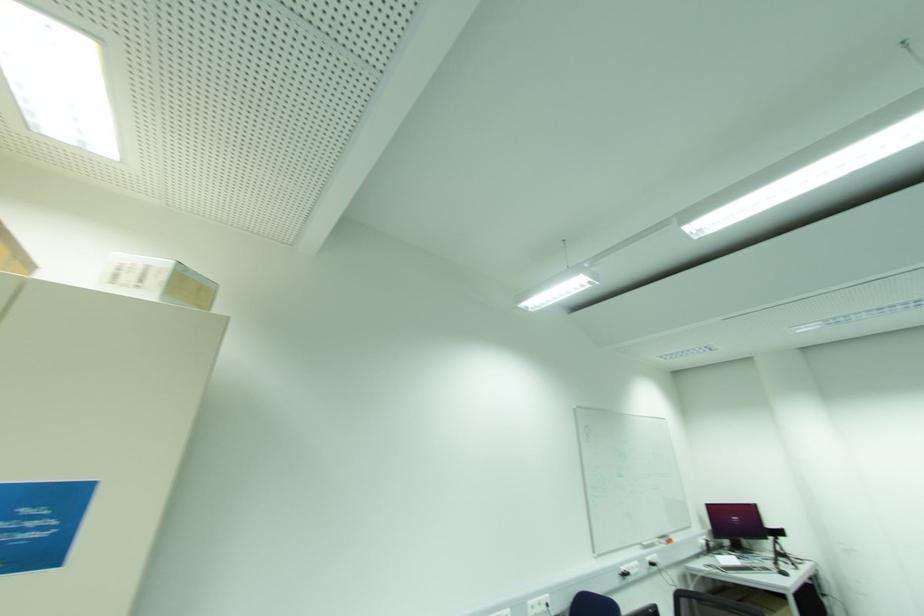
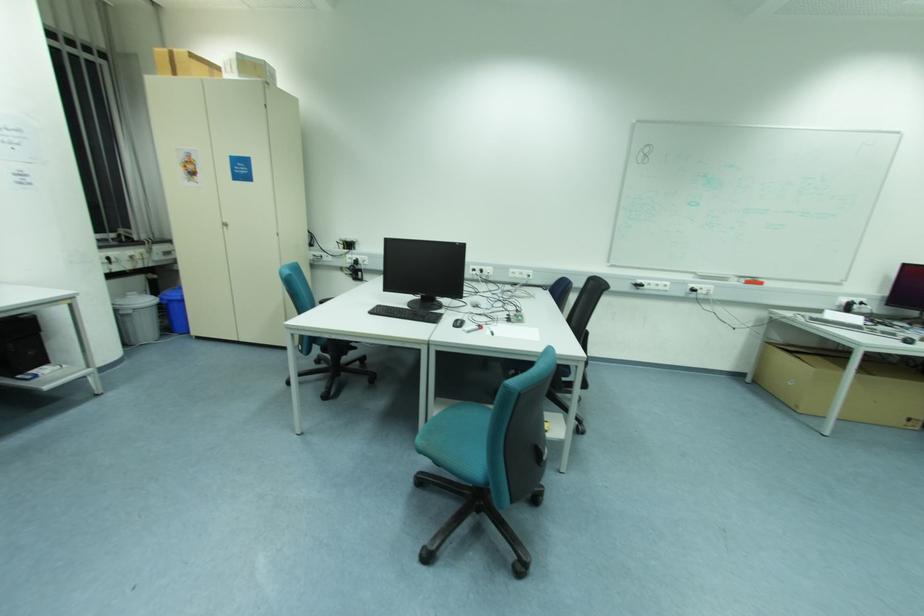
In the second image, find the point that corresponds to point (672, 541) in the first image.

(761, 284)